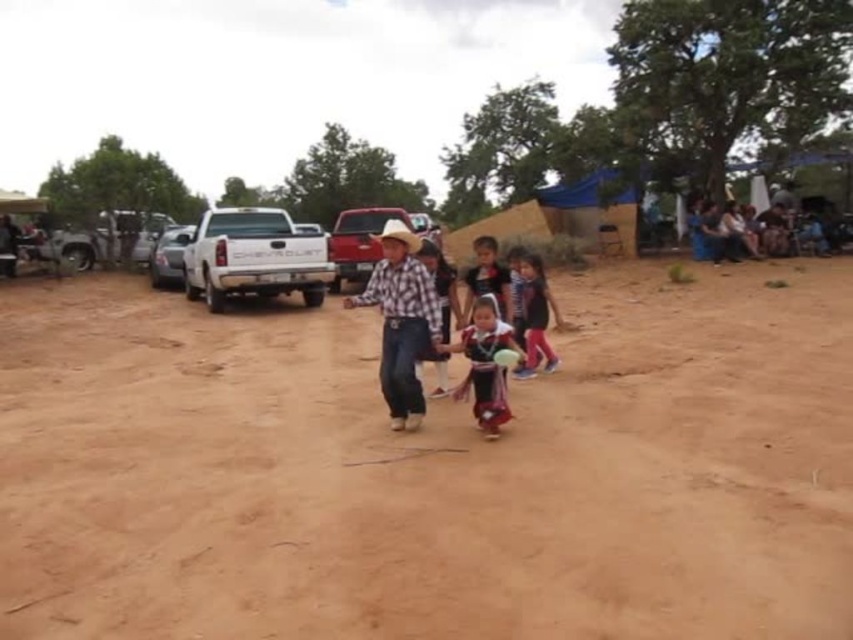
You are a photographer at the event and need to capture both the embroidered fabric dress at center and the dark blue fabric dress at center in a single frame. Which dress should you focus on to ensure both are visible without zooming in too much?

The embroidered fabric dress at center is smaller in size compared to the dark blue fabric dress at center, so focusing on the dark blue fabric dress at center would help keep both dresses visible without excessive zoom.

You are a photographer positioned at the edge of the dirt field. You want to capture a photo that includes both the embroidered fabric dress at center and the dark blue fabric dress at center. Which dress should you focus on first to ensure both are in the frame?

You should focus on the embroidered fabric dress at center first because it is closer to the viewer than the dark blue fabric dress at center, ensuring both will be in the frame when properly focused.

You are a photographer trying to capture a group photo of the plaid fabric shirt at center and the matte black dress at center. The camera you are using has a minimum focusing distance of 1.5 meters. Will you be able to take a clear photo of both subjects without moving the camera or the subjects?

The distance between the plaid fabric shirt at center and the matte black dress at center is 1.32 meters. Since the camera requires a minimum focusing distance of 1.5 meters, you will not be able to capture both subjects clearly without adjusting the camera or moving them closer together.